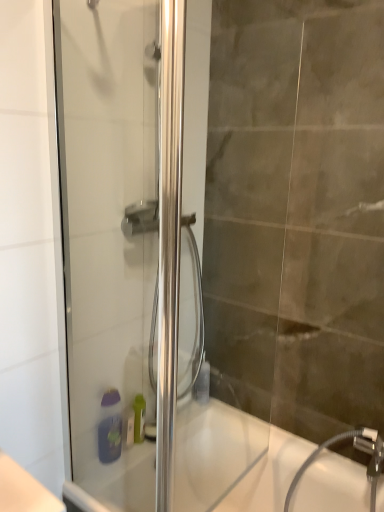
Question: Choose the correct answer: Is white glossy bathtub at lower center inside clear glass shower door at left or outside it?

Choices:
 (A) inside
 (B) outside

Answer: (B)

Question: Considering the positions of white glossy bathtub at lower center and clear glass shower door at left in the image, is white glossy bathtub at lower center bigger or smaller than clear glass shower door at left?

Choices:
 (A) small
 (B) big

Answer: (B)

Question: Which object is the closest to the translucent plastic bottle at lower center?

Choices:
 (A) purple matte soap dispenser at lower center
 (B) white glossy bathtub at lower center
 (C) clear glass shower door at left

Answer: (B)

Question: Considering the real-world distances, which object is farthest from the translucent plastic bottle at lower center?

Choices:
 (A) purple matte soap dispenser at lower center
 (B) clear glass shower door at left
 (C) white glossy bathtub at lower center

Answer: (B)